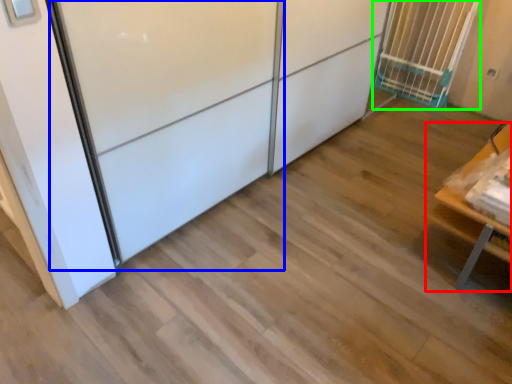
Question: Which object is the closest to the furniture (highlighted by a red box)? Choose among these: screen door (highlighted by a blue box) or cage (highlighted by a green box).

Choices:
 (A) screen door
 (B) cage

Answer: (A)